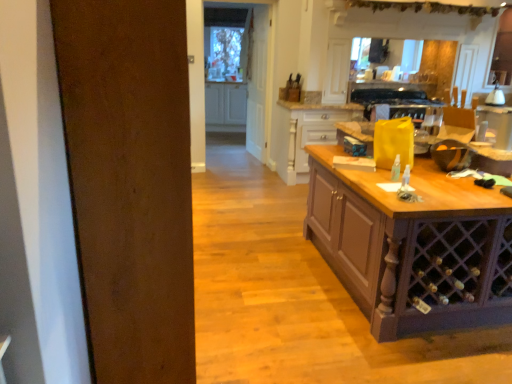
Question: Does white glossy cabinet at center, the 2th cabinetry positioned from the front, have a greater height compared to white wood door at center?

Choices:
 (A) no
 (B) yes

Answer: (A)

Question: Is white wood door at center surrounded by white glossy cabinet at center, the 2th cabinetry positioned from the front?

Choices:
 (A) yes
 (B) no

Answer: (B)

Question: Does white glossy cabinet at center, the second cabinetry positioned from the bottom, appear on the right side of white wood door at center?

Choices:
 (A) yes
 (B) no

Answer: (B)

Question: From the image's perspective, is white glossy cabinet at center, arranged as the 1th cabinetry when viewed from the back, beneath white wood door at center?

Choices:
 (A) yes
 (B) no

Answer: (B)

Question: Could you tell me if white glossy cabinet at center, the 1th cabinetry when ordered from top to bottom, is facing white wood door at center?

Choices:
 (A) yes
 (B) no

Answer: (A)

Question: From the image's perspective, is wooden drawer at center, placed as the first cabinetry when sorted from right to left, positioned above or below black glass oven at upper center?

Choices:
 (A) below
 (B) above

Answer: (A)

Question: Is wooden drawer at center, the second cabinetry when ordered from top to bottom, situated inside black glass oven at upper center or outside?

Choices:
 (A) inside
 (B) outside

Answer: (B)

Question: In the image, is wooden drawer at center, the second cabinetry when ordered from top to bottom, positioned in front of or behind black glass oven at upper center?

Choices:
 (A) front
 (B) behind

Answer: (A)

Question: Would you say wooden drawer at center, the second cabinetry when ordered from top to bottom, is to the left or to the right of black glass oven at upper center in the picture?

Choices:
 (A) left
 (B) right

Answer: (A)

Question: Is wooden drawer at center, the second cabinetry viewed from the back, in front of or behind white glossy lamp at upper right in the image?

Choices:
 (A) behind
 (B) front

Answer: (B)

Question: From a real-world perspective, is wooden drawer at center, placed as the first cabinetry when sorted from right to left, physically located above or below white glossy lamp at upper right?

Choices:
 (A) above
 (B) below

Answer: (B)

Question: In terms of height, does wooden drawer at center, the second cabinetry viewed from the back, look taller or shorter compared to white glossy lamp at upper right?

Choices:
 (A) short
 (B) tall

Answer: (B)

Question: Is wooden drawer at center, placed as the second cabinetry when sorted from left to right, wider or thinner than white glossy lamp at upper right?

Choices:
 (A) thin
 (B) wide

Answer: (B)

Question: In terms of height, does clear glass door at center look taller or shorter compared to wooden drawer at center, placed as the first cabinetry when sorted from right to left?

Choices:
 (A) tall
 (B) short

Answer: (A)

Question: Is clear glass door at center wider or thinner than wooden drawer at center, placed as the first cabinetry when sorted from right to left?

Choices:
 (A) wide
 (B) thin

Answer: (B)